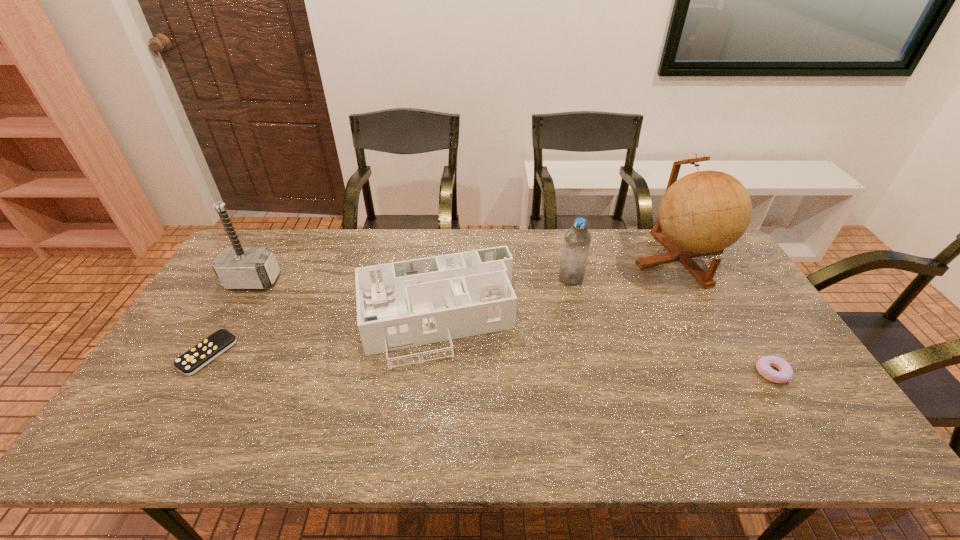
Identify the location of vacant space positioned on the left of the third object from right to left. The height and width of the screenshot is (540, 960). (503, 279).

Identify the location of vacant region located 0.310m on the right of the third object from left to right. (619, 318).

Find the location of a particular element. The image size is (960, 540). vacant position located 0.070m on the left of the fifth tallest object is located at coordinates click(730, 373).

You are a GUI agent. You are given a task and a screenshot of the screen. Output one action in this format:
    pyautogui.click(x=<x>, y=<y>)
    Task: Click on the blank area located on the front of the shortest object
    The image size is (960, 540).
    Given the screenshot: What is the action you would take?
    pyautogui.click(x=172, y=415)

I want to click on globe that is at the far edge, so click(x=704, y=212).

Locate an element on the screen. Image resolution: width=960 pixels, height=540 pixels. hammer located at the far edge is located at coordinates (237, 267).

You are a GUI agent. You are given a task and a screenshot of the screen. Output one action in this format:
    pyautogui.click(x=<x>, y=<y>)
    Task: Click on the water bottle present at the far edge
    
    Given the screenshot: What is the action you would take?
    pyautogui.click(x=577, y=239)

Where is `hammer present at the left edge`? The height and width of the screenshot is (540, 960). hammer present at the left edge is located at coordinates (237, 267).

Identify the location of remote control located at the left edge. The image size is (960, 540). (196, 358).

Where is `globe that is at the right edge`? globe that is at the right edge is located at coordinates (704, 212).